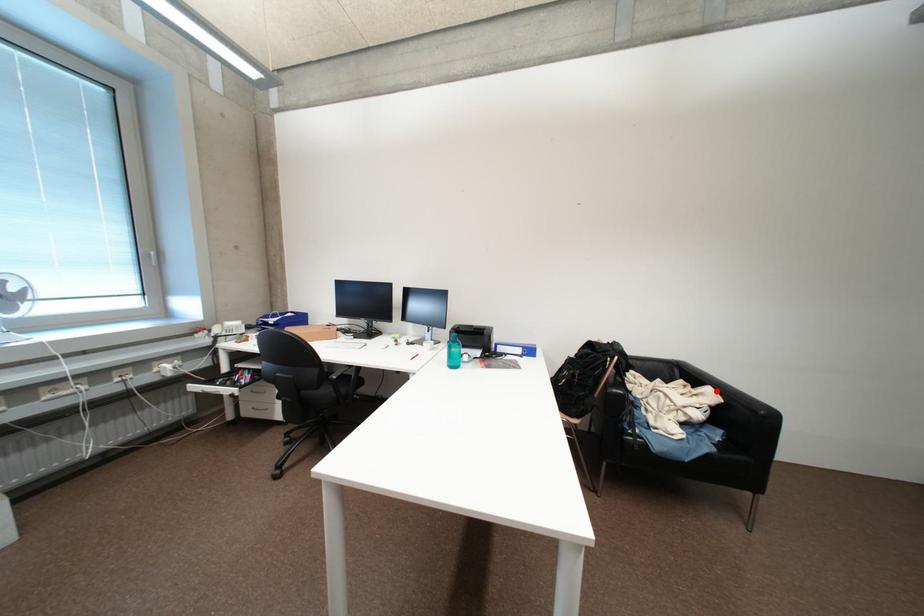
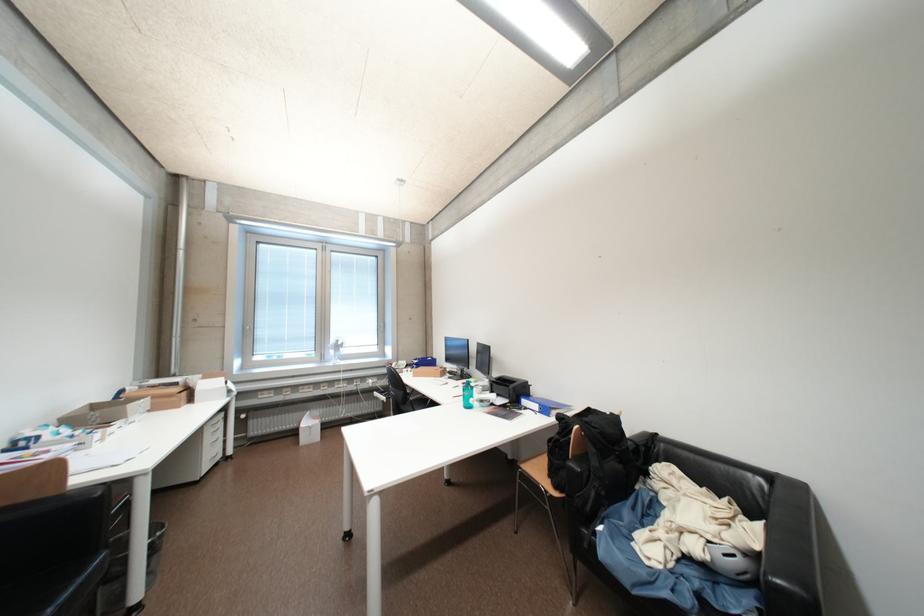
Locate, in the second image, the point that corresponds to the highlighted location in the first image.

(769, 528)